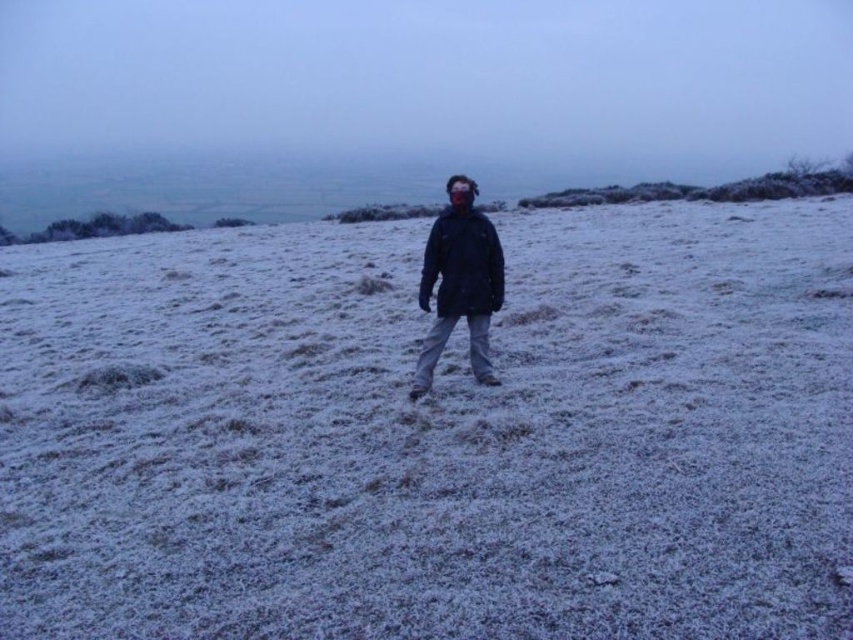
Which of these two, matte black jacket at center or dark blue matte jacket at center, stands taller?

A: Standing taller between the two is matte black jacket at center.

Does matte black jacket at center appear on the left side of dark blue matte jacket at center?

Incorrect, matte black jacket at center is not on the left side of dark blue matte jacket at center.

Is point (416, 296) positioned after point (467, 262)?

Yes, it is behind point (467, 262).

You are a GUI agent. You are given a task and a screenshot of the screen. Output one action in this format:
    pyautogui.click(x=<x>, y=<y>)
    Task: Click on the matte black jacket at center
    The height and width of the screenshot is (640, 853).
    Given the screenshot: What is the action you would take?
    pyautogui.click(x=459, y=282)

Between point (611, 305) and point (463, 273), which one is positioned in front?

Point (463, 273)

Can you confirm if frosted grass at center is positioned below dark blue matte jacket at center?

Yes.

Describe the element at coordinates (433, 433) in the screenshot. I see `frosted grass at center` at that location.

The height and width of the screenshot is (640, 853). What are the coordinates of `frosted grass at center` in the screenshot? It's located at (433, 433).

Who is more forward, (650, 464) or (434, 225)?

Point (650, 464) is in front.

Find the location of a particular element. The image size is (853, 640). frosted grass at center is located at coordinates (433, 433).

What do you see at coordinates (433, 433) in the screenshot? The width and height of the screenshot is (853, 640). I see `frosted grass at center` at bounding box center [433, 433].

The height and width of the screenshot is (640, 853). In order to click on frosted grass at center in this screenshot , I will do `click(433, 433)`.